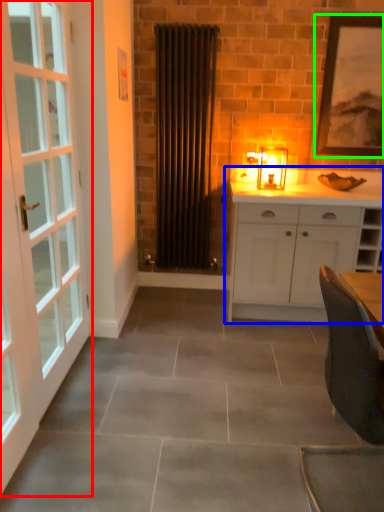
Question: Based on their relative distances, which object is nearer to door (highlighted by a red box)? Choose from cabinetry (highlighted by a blue box) and picture frame (highlighted by a green box).

Choices:
 (A) cabinetry
 (B) picture frame

Answer: (A)